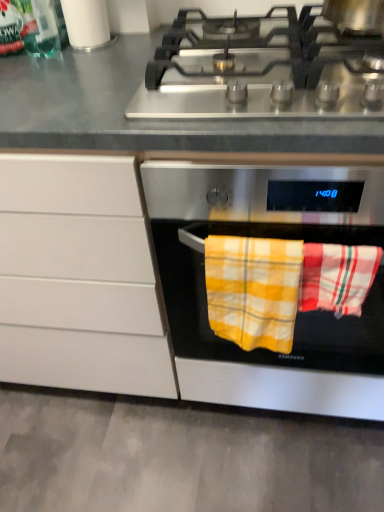
In order to face stainless steel oven at center, should I rotate leftwards or rightwards?

Turn right by 14.008 degrees to look at stainless steel oven at center.

What do you see at coordinates (355, 15) in the screenshot?
I see `metallic silver pot at upper right` at bounding box center [355, 15].

The height and width of the screenshot is (512, 384). In order to click on red plaid beach towel at center, placed as the second beach towel when sorted from left to right in this screenshot , I will do point(337,277).

What do you see at coordinates (337, 277) in the screenshot?
I see `red plaid beach towel at center, placed as the second beach towel when sorted from left to right` at bounding box center [337, 277].

Where is `stainless steel gas stove at upper center`? stainless steel gas stove at upper center is located at coordinates (267, 64).

What is the approximate height of white matte cabinet at center?

It is 96.83 centimeters.

Where is `stainless steel oven at center`? stainless steel oven at center is located at coordinates (297, 314).

Is point (23, 339) more distant than point (322, 303)?

Yes, it is behind point (322, 303).

Relative to red plaid beach towel at center, the first beach towel when ordered from right to left, is white matte cabinet at center in front or behind?

Visually, white matte cabinet at center is located behind red plaid beach towel at center, the first beach towel when ordered from right to left.

Does white matte cabinet at center contain red plaid beach towel at center, placed as the second beach towel when sorted from left to right?

Definitely not — red plaid beach towel at center, placed as the second beach towel when sorted from left to right, is not inside white matte cabinet at center.

Considering the points (102, 279) and (274, 336), which point is in front, point (102, 279) or point (274, 336)?

The point (274, 336) is closer.

From the image's perspective, between white matte cabinet at center and yellow plaid towel at center, which is the 2th beach towel from right to left, who is located below?

From the image's view, yellow plaid towel at center, which is the 2th beach towel from right to left, is below.

Are white matte cabinet at center and yellow plaid towel at center, which is the 1th beach towel from left to right, beside each other?

No, white matte cabinet at center is not in contact with yellow plaid towel at center, which is the 1th beach towel from left to right.

In the scene shown: Can you confirm if metallic silver pot at upper right is wider than stainless steel oven at center?

No.

Can you confirm if metallic silver pot at upper right is positioned to the right of stainless steel oven at center?

Indeed, metallic silver pot at upper right is positioned on the right side of stainless steel oven at center.

Where is `oven beneath the metallic silver pot at upper right (from a real-world perspective)`? This screenshot has height=512, width=384. oven beneath the metallic silver pot at upper right (from a real-world perspective) is located at coordinates (297, 314).

Considering the relative sizes of yellow plaid towel at center, which is the 1th beach towel from left to right, and metallic silver pot at upper right in the image provided, is yellow plaid towel at center, which is the 1th beach towel from left to right, shorter than metallic silver pot at upper right?

No, yellow plaid towel at center, which is the 1th beach towel from left to right, is not shorter than metallic silver pot at upper right.

In the scene shown: Is metallic silver pot at upper right at the back of yellow plaid towel at center, which is the 1th beach towel from left to right?

No, yellow plaid towel at center, which is the 1th beach towel from left to right, is not facing the opposite direction of metallic silver pot at upper right.

From a real-world perspective, is yellow plaid towel at center, which is the 1th beach towel from left to right, physically located above or below metallic silver pot at upper right?

yellow plaid towel at center, which is the 1th beach towel from left to right, is situated lower than metallic silver pot at upper right in the real world.

Is yellow plaid towel at center, which is the 2th beach towel from right to left, thinner than metallic silver pot at upper right?

Yes, yellow plaid towel at center, which is the 2th beach towel from right to left, is thinner than metallic silver pot at upper right.

Looking at the image, does yellow plaid towel at center, which is the 1th beach towel from left to right, seem bigger or smaller compared to stainless steel gas stove at upper center?

yellow plaid towel at center, which is the 1th beach towel from left to right, is smaller than stainless steel gas stove at upper center.

Measure the distance from yellow plaid towel at center, which is the 1th beach towel from left to right, to stainless steel gas stove at upper center.

yellow plaid towel at center, which is the 1th beach towel from left to right, and stainless steel gas stove at upper center are 13.80 inches apart from each other.

From a real-world perspective, relative to stainless steel gas stove at upper center, is yellow plaid towel at center, which is the 2th beach towel from right to left, vertically above or below?

yellow plaid towel at center, which is the 2th beach towel from right to left, is below stainless steel gas stove at upper center.

Between yellow plaid towel at center, which is the 2th beach towel from right to left, and stainless steel gas stove at upper center, which one is positioned behind?

yellow plaid towel at center, which is the 2th beach towel from right to left, is further from the camera.

Is metallic silver pot at upper right taller than white paper towel at upper left?

No, metallic silver pot at upper right is not taller than white paper towel at upper left.

Is metallic silver pot at upper right inside the boundaries of white paper towel at upper left, or outside?

metallic silver pot at upper right is not enclosed by white paper towel at upper left.

Is metallic silver pot at upper right smaller than white paper towel at upper left?

No, metallic silver pot at upper right is not smaller than white paper towel at upper left.

Can you confirm if metallic silver pot at upper right is wider than white paper towel at upper left?

Yes, metallic silver pot at upper right is wider than white paper towel at upper left.

Which object is further away from the camera taking this photo, yellow plaid towel at center, which is the 2th beach towel from right to left, or white matte cabinet at center?

yellow plaid towel at center, which is the 2th beach towel from right to left.

In terms of size, does yellow plaid towel at center, which is the 2th beach towel from right to left, appear bigger or smaller than white matte cabinet at center?

yellow plaid towel at center, which is the 2th beach towel from right to left, is smaller than white matte cabinet at center.

Could you tell me if yellow plaid towel at center, which is the 2th beach towel from right to left, is facing white matte cabinet at center?

No.

Find the location of `cabinetry below the yellow plaid towel at center, which is the 2th beach towel from right to left (from a real-world perspective)`. cabinetry below the yellow plaid towel at center, which is the 2th beach towel from right to left (from a real-world perspective) is located at coordinates (79, 278).

There is a white matte cabinet at center. At what (x,y) coordinates should I click in order to perform the action: click on the 2nd beach towel above it (from a real-world perspective). Please return your answer as a coordinate pair (x, y). The height and width of the screenshot is (512, 384). Looking at the image, I should click on (337, 277).

Identify the location of cabinetry above the yellow plaid towel at center, which is the 2th beach towel from right to left (from the image's perspective). (79, 278).

Looking at the image, which one is located closer to white paper towel at upper left, yellow plaid towel at center, which is the 2th beach towel from right to left, or stainless steel oven at center?

yellow plaid towel at center, which is the 2th beach towel from right to left, lies closer to white paper towel at upper left than the other object.

Looking at the image, which one is located closer to red plaid beach towel at center, the first beach towel when ordered from right to left, white paper towel at upper left or stainless steel gas stove at upper center?

Among the two, stainless steel gas stove at upper center is located nearer to red plaid beach towel at center, the first beach towel when ordered from right to left.

Looking at the image, which one is located closer to metallic silver pot at upper right, white paper towel at upper left or stainless steel gas stove at upper center?

stainless steel gas stove at upper center lies closer to metallic silver pot at upper right than the other object.

In the scene shown: Which object lies nearer to the anchor point yellow plaid towel at center, which is the 1th beach towel from left to right, white paper towel at upper left or metallic silver pot at upper right?

metallic silver pot at upper right is closer to yellow plaid towel at center, which is the 1th beach towel from left to right.

Looking at the image, which one is located closer to red plaid beach towel at center, placed as the second beach towel when sorted from left to right, metallic silver pot at upper right or white paper towel at upper left?

Among the two, metallic silver pot at upper right is located nearer to red plaid beach towel at center, placed as the second beach towel when sorted from left to right.

Which object lies nearer to the anchor point stainless steel gas stove at upper center, red plaid beach towel at center, placed as the second beach towel when sorted from left to right, or white paper towel at upper left?

red plaid beach towel at center, placed as the second beach towel when sorted from left to right, is positioned closer to the anchor stainless steel gas stove at upper center.

When comparing their distances from red plaid beach towel at center, the first beach towel when ordered from right to left, does stainless steel oven at center or stainless steel gas stove at upper center seem closer?

Among the two, stainless steel oven at center is located nearer to red plaid beach towel at center, the first beach towel when ordered from right to left.

Based on their spatial positions, is red plaid beach towel at center, placed as the second beach towel when sorted from left to right, or stainless steel oven at center closer to stainless steel gas stove at upper center?

stainless steel oven at center lies closer to stainless steel gas stove at upper center than the other object.

Identify the location of oven between white matte cabinet at center and metallic silver pot at upper right in the horizontal direction. The height and width of the screenshot is (512, 384). (297, 314).

Find the location of a particular element. The width and height of the screenshot is (384, 512). oven between stainless steel gas stove at upper center and yellow plaid towel at center, which is the 1th beach towel from left to right, in the up-down direction is located at coordinates point(297,314).

Identify the location of cabinetry between white paper towel at upper left and red plaid beach towel at center, the first beach towel when ordered from right to left, in the vertical direction. The width and height of the screenshot is (384, 512). (79, 278).

Find the location of a particular element. This screenshot has width=384, height=512. oven that lies between white paper towel at upper left and red plaid beach towel at center, the first beach towel when ordered from right to left, from top to bottom is located at coordinates (297, 314).